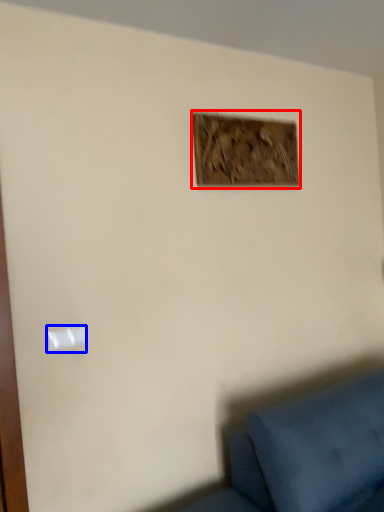
Question: Which object appears farthest to the camera in this image, picture frame (highlighted by a red box) or light switch (highlighted by a blue box)?

Choices:
 (A) picture frame
 (B) light switch

Answer: (A)